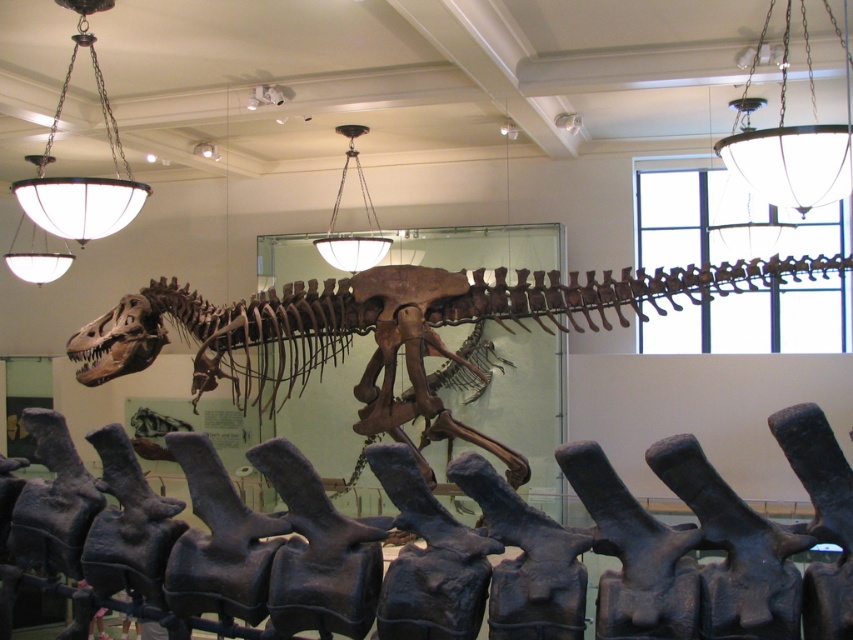
Between matte glass chandelier at upper center and white glass chandelier at upper center, which one is positioned lower?

Positioned lower is white glass chandelier at upper center.

Based on the photo, who is positioned more to the right, matte glass chandelier at upper center or white glass chandelier at upper center?

matte glass chandelier at upper center

The width and height of the screenshot is (853, 640). I want to click on matte glass chandelier at upper center, so click(x=791, y=156).

Does rusty metallic dinosaur at center appear on the left side of white glass chandelier at upper center?

No, rusty metallic dinosaur at center is not to the left of white glass chandelier at upper center.

Does rusty metallic dinosaur at center have a lesser width compared to white glass chandelier at upper center?

A: Incorrect, rusty metallic dinosaur at center's width is not less than white glass chandelier at upper center's.

Who is more forward, [146,588] or [345,260]?

Point [146,588] is in front.

Find the location of a particular element. The image size is (853, 640). rusty metallic dinosaur at center is located at coordinates (526, 550).

Does rusty metallic dinosaur at center have a larger size compared to matte glass chandelier at upper center?

Yes, rusty metallic dinosaur at center is bigger than matte glass chandelier at upper center.

Who is more distant from viewer, (x=606, y=582) or (x=809, y=141)?

Positioned behind is point (x=809, y=141).

Locate an element on the screen. The height and width of the screenshot is (640, 853). rusty metallic dinosaur at center is located at coordinates (526, 550).

Image resolution: width=853 pixels, height=640 pixels. Identify the location of rusty metallic dinosaur at center. (526, 550).